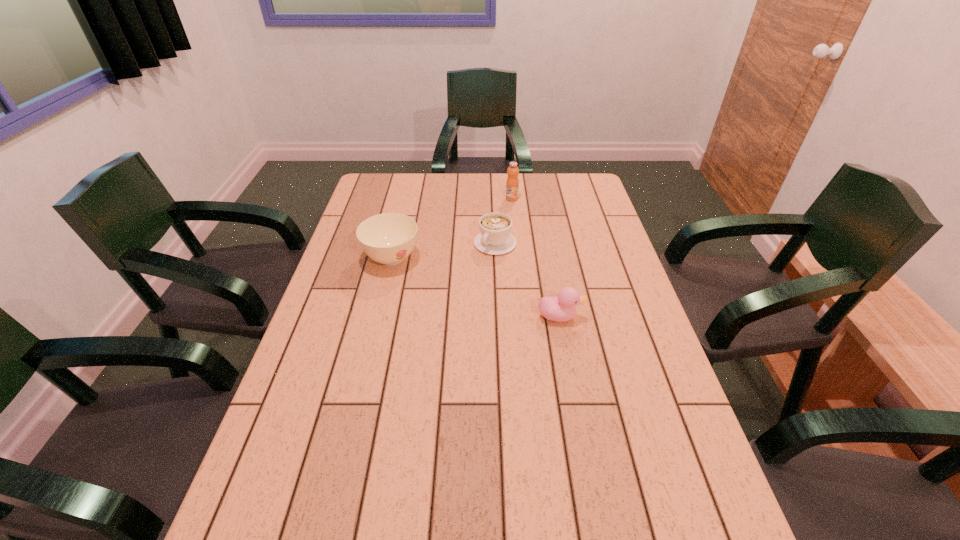
Find the location of `vacant space located to the right of the shortest object's handle`. vacant space located to the right of the shortest object's handle is located at coordinates (478, 264).

Locate an element on the screen. The height and width of the screenshot is (540, 960). vacant space located on the front label of the farthest object is located at coordinates (459, 262).

Where is `free region located 0.130m on the front label of the farthest object`? free region located 0.130m on the front label of the farthest object is located at coordinates (494, 219).

You are a GUI agent. You are given a task and a screenshot of the screen. Output one action in this format:
    pyautogui.click(x=<x>, y=<y>)
    Task: Click on the vacant region located 0.110m on the front label of the farthest object
    The image size is (960, 540).
    Given the screenshot: What is the action you would take?
    pyautogui.click(x=497, y=216)

What are the coordinates of `object situated at the far edge` in the screenshot? It's located at (512, 184).

You are a GUI agent. You are given a task and a screenshot of the screen. Output one action in this format:
    pyautogui.click(x=<x>, y=<y>)
    Task: Click on the object that is positioned at the left edge
    The height and width of the screenshot is (540, 960).
    Given the screenshot: What is the action you would take?
    pyautogui.click(x=388, y=238)

Identify the location of vacant space at the far edge. (497, 179).

You are a GUI agent. You are given a task and a screenshot of the screen. Output one action in this format:
    pyautogui.click(x=<x>, y=<y>)
    Task: Click on the blank area at the left edge
    The image size is (960, 540).
    Given the screenshot: What is the action you would take?
    pyautogui.click(x=286, y=448)

The height and width of the screenshot is (540, 960). Find the location of `free space at the right edge`. free space at the right edge is located at coordinates 567,206.

In order to click on vacant space at the far right corner of the desktop in this screenshot , I will do `click(557, 195)`.